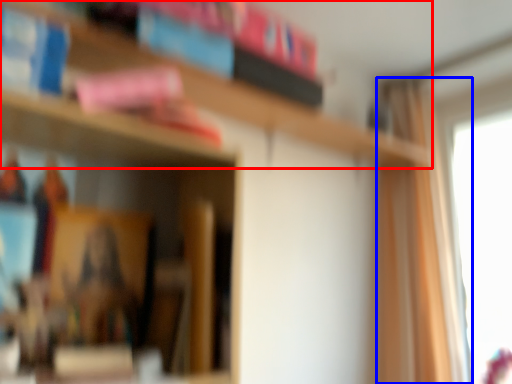
Question: Which object is closer to the camera taking this photo, bookcase (highlighted by a red box) or curtain (highlighted by a blue box)?

Choices:
 (A) bookcase
 (B) curtain

Answer: (A)